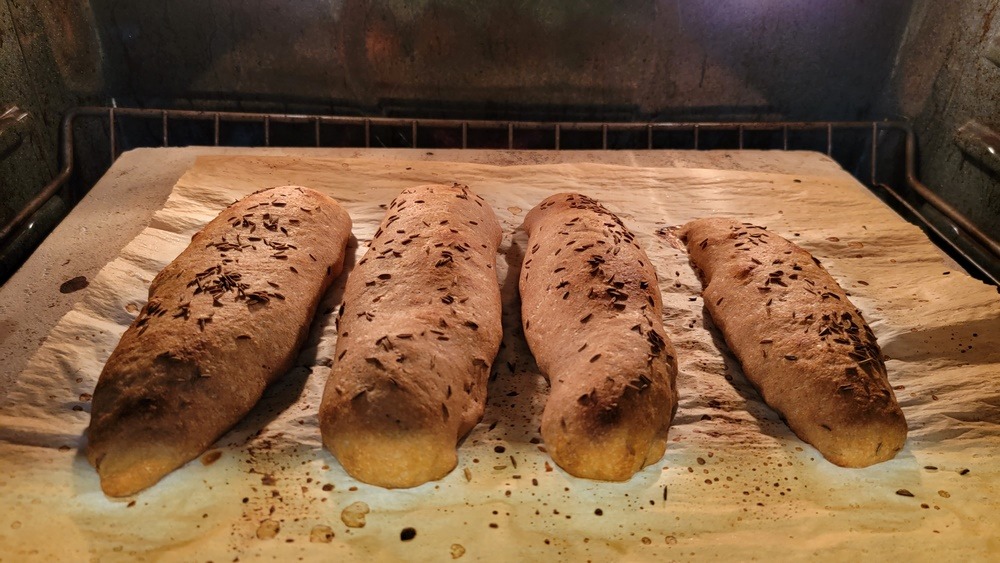
At what (x,y) coordinates should I click in order to perform the action: click on rack. Please return your answer as a coordinate pair (x, y). The image size is (1000, 563). Looking at the image, I should click on (110, 127).